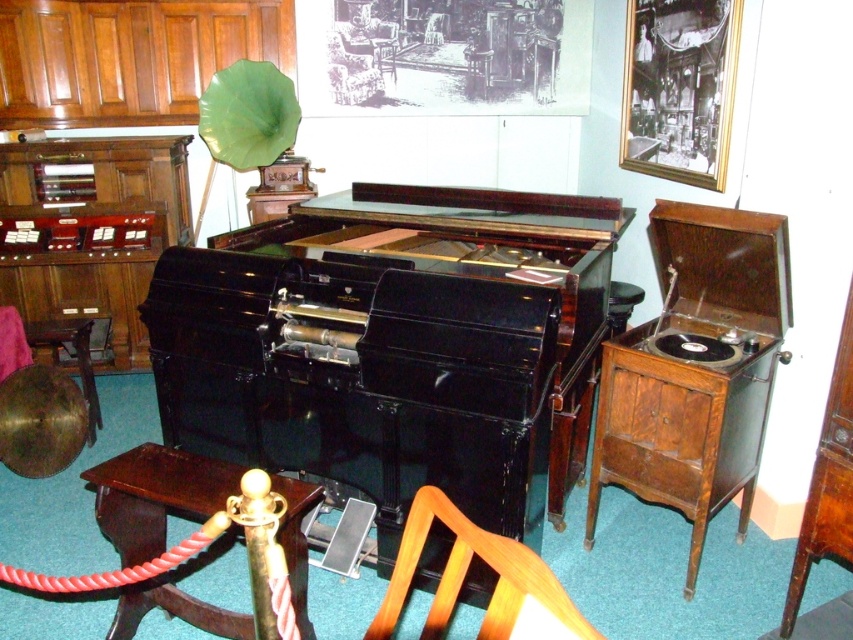
You are standing at the entrance of the museum exhibit and want to sit down to rest. There is a wooden chair at lower center. Can you reach it without moving any of the historical audio equipment displayed?

The wooden chair at lower center is 1.04 meters away from the nearest equipment, so yes, you can reach it without disturbing the displayed items.

You are a museum visitor standing in front of the historical audio equipment display. You notice two points marked on the display. Which point, point [141,582] or point [670,460], is closer to you?

Point [141,582] is closer to the viewer than point [670,460].

You are a museum visitor who wants to sit down while observing the historical audio equipment. There is a wooden chair at lower center and a brown wood drawer at lower right. Which object is wider, making it more suitable for sitting?

The wooden chair at lower center is wider than the brown wood drawer at lower right, so it is more suitable for sitting.